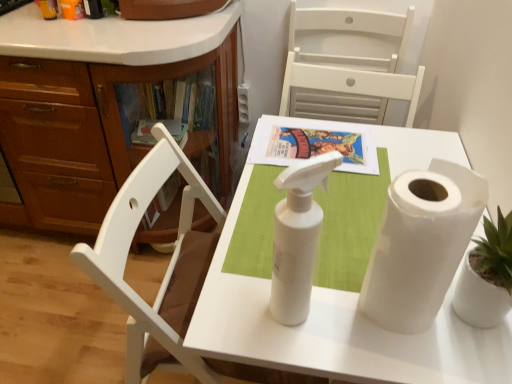
Question: From the image's perspective, is white matte chair at upper center above or below white matte paper towel roll at center?

Choices:
 (A) above
 (B) below

Answer: (A)

Question: From a real-world perspective, is white matte chair at upper center physically located above or below white matte paper towel roll at center?

Choices:
 (A) below
 (B) above

Answer: (B)

Question: Estimate the real-world distances between objects in this image. Which object is farther from the white matte paper towel roll at center?

Choices:
 (A) white matte spray bottle at center
 (B) matte paper book at center
 (C) white matte chair at upper center
 (D) white paper at right

Answer: (C)

Question: Considering the real-world distances, which object is farthest from the matte paper book at center?

Choices:
 (A) white paper at right
 (B) white matte chair at upper center
 (C) white matte paper towel roll at center
 (D) white matte spray bottle at center

Answer: (B)